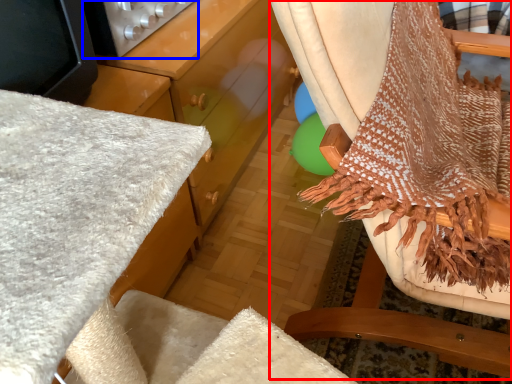
Question: Which of the following is the closest to the observer, chair (highlighted by a red box) or appliance (highlighted by a blue box)?

Choices:
 (A) chair
 (B) appliance

Answer: (A)